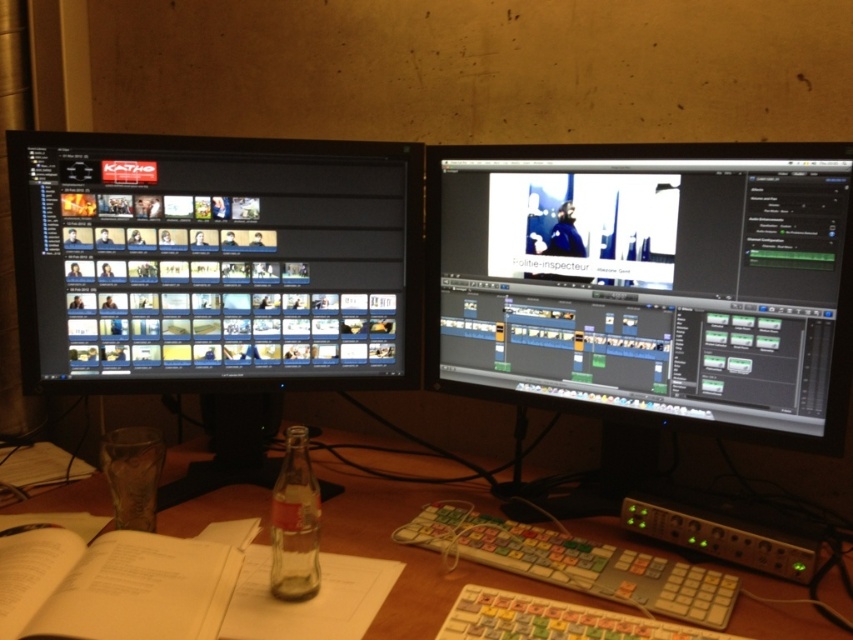
You are a video editor working at this desk and need to locate two specific points on your monitors. The first point is at coordinate point (836, 449) and the second is at coordinate point (39, 369). Which point is closer to the bottom edge of the desk?

Point (39, 369) is closer to the bottom edge of the desk because it has a lower y coordinate value than point (836, 449).

You are a video editor working at this desk and need to reach both the matte black monitor at center and the black glossy monitor at left. Which monitor will you have to stretch further to reach?

You will have to stretch further to reach the black glossy monitor at left because it is farther from you compared to the matte black monitor at center, which is closer.

In the scene shown: You are a video editor working at this desk. You need to place both the white paper book at lower left and the white plastic keyboard at lower center into a storage box. The box has a height limit of 10 cm. Which item might not fit due to its height?

The white paper book at lower left is much taller than the white plastic keyboard at lower center, so it might not fit into the storage box with a 10 cm height limit.